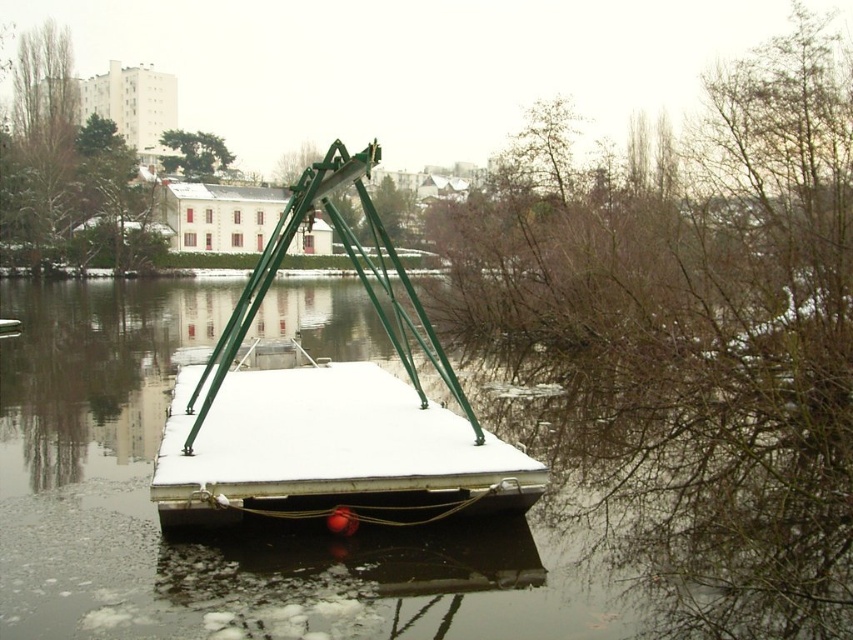
How far apart are white snow-covered dock at center and green metallic boat at center?

white snow-covered dock at center and green metallic boat at center are 3.75 meters apart from each other.

The image size is (853, 640). Find the location of `white snow-covered dock at center`. white snow-covered dock at center is located at coordinates (260, 536).